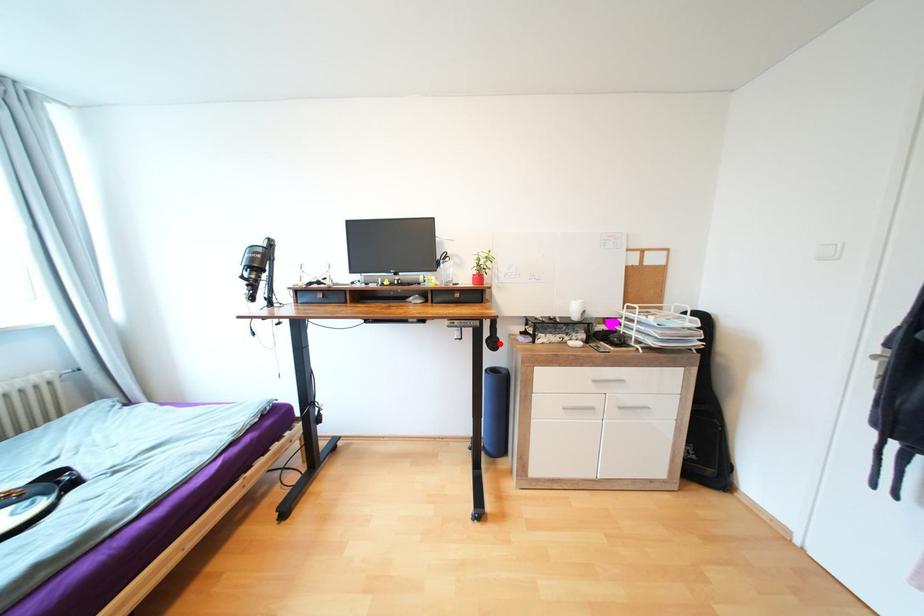
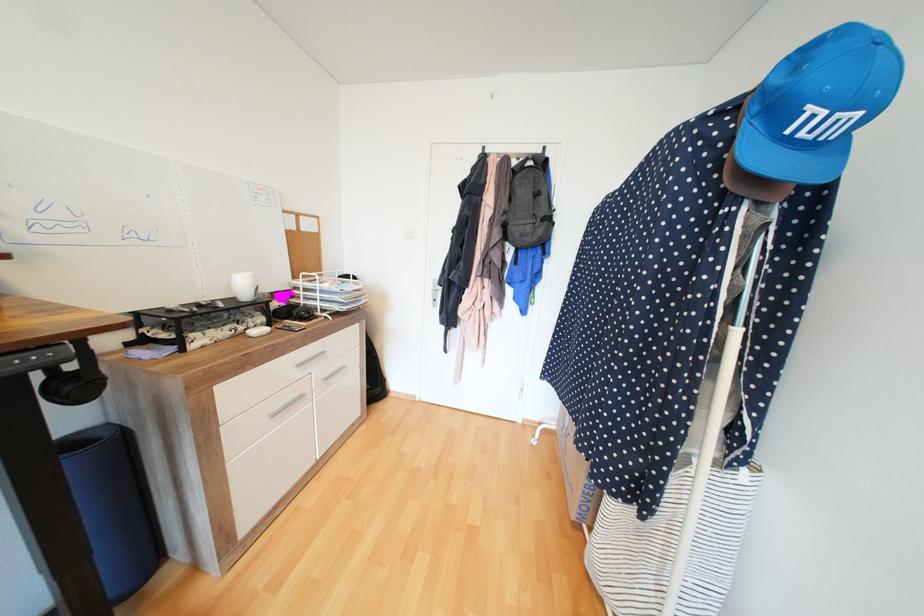
In the second image, find the point that corresponds to the highlighted location in the first image.

(88, 387)